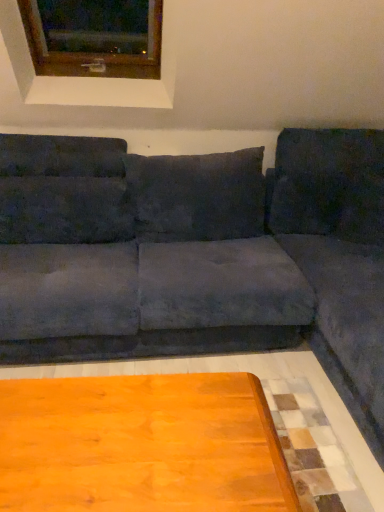
Question: Is velvet dark gray pillow at right, which is the 3th pillow in left-to-right order, closer to the viewer compared to suede-like dark gray pillow at upper left, positioned as the 3th pillow in right-to-left order?

Choices:
 (A) yes
 (B) no

Answer: (B)

Question: From a real-world perspective, is velvet dark gray pillow at right, which is the 3th pillow in left-to-right order, located beneath suede-like dark gray pillow at upper left, marked as the first pillow in a left-to-right arrangement?

Choices:
 (A) yes
 (B) no

Answer: (B)

Question: From the image's perspective, does velvet dark gray pillow at right, which is the 3th pillow in left-to-right order, appear higher than suede-like dark gray pillow at upper left, positioned as the 3th pillow in right-to-left order?

Choices:
 (A) no
 (B) yes

Answer: (B)

Question: From the image's perspective, is velvet dark gray pillow at right, which appears as the first pillow when viewed from the right, beneath suede-like dark gray pillow at upper left, marked as the first pillow in a left-to-right arrangement?

Choices:
 (A) yes
 (B) no

Answer: (B)

Question: Is velvet dark gray pillow at right, which is the 3th pillow in left-to-right order, facing towards suede-like dark gray pillow at upper left, positioned as the 3th pillow in right-to-left order?

Choices:
 (A) no
 (B) yes

Answer: (A)

Question: From the image's perspective, relative to velvet dark gray pillow at right, which appears as the first pillow when viewed from the right, is wooden frame at upper left above or below?

Choices:
 (A) below
 (B) above

Answer: (B)

Question: Based on their sizes in the image, would you say wooden frame at upper left is bigger or smaller than velvet dark gray pillow at right, which appears as the first pillow when viewed from the right?

Choices:
 (A) small
 (B) big

Answer: (B)

Question: In the image, is wooden frame at upper left positioned in front of or behind velvet dark gray pillow at right, which appears as the first pillow when viewed from the right?

Choices:
 (A) front
 (B) behind

Answer: (A)

Question: Based on their positions, is wooden frame at upper left located to the left or right of velvet dark gray pillow at right, which appears as the first pillow when viewed from the right?

Choices:
 (A) left
 (B) right

Answer: (A)

Question: Would you say wooden table at lower center is to the left or to the right of dark gray suede pillow at center, the 2th pillow when ordered from right to left, in the picture?

Choices:
 (A) left
 (B) right

Answer: (A)

Question: Based on their sizes in the image, would you say wooden table at lower center is bigger or smaller than dark gray suede pillow at center, marked as the second pillow in a left-to-right arrangement?

Choices:
 (A) big
 (B) small

Answer: (A)

Question: From a real-world perspective, is wooden table at lower center positioned above or below dark gray suede pillow at center, the 2th pillow when ordered from right to left?

Choices:
 (A) below
 (B) above

Answer: (A)

Question: Does point (87, 471) appear closer or farther from the camera than point (137, 198)?

Choices:
 (A) farther
 (B) closer

Answer: (B)

Question: Which is correct: suede gray couch at center is inside suede-like dark gray pillow at upper left, marked as the first pillow in a left-to-right arrangement, or outside of it?

Choices:
 (A) outside
 (B) inside

Answer: (A)

Question: Is suede gray couch at center wider or thinner than suede-like dark gray pillow at upper left, marked as the first pillow in a left-to-right arrangement?

Choices:
 (A) thin
 (B) wide

Answer: (B)